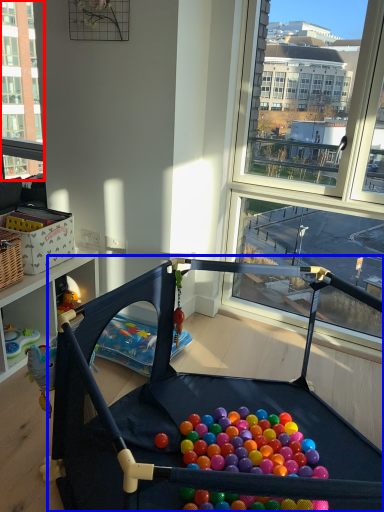
Question: Which of the following is the farthest to the observer, window (highlighted by a red box) or baby carriage (highlighted by a blue box)?

Choices:
 (A) window
 (B) baby carriage

Answer: (A)